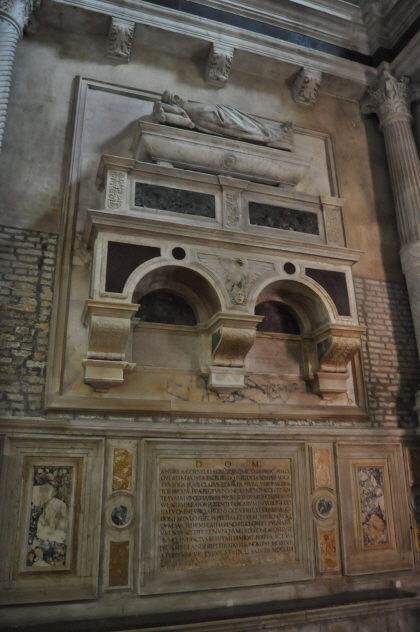
Identify the location of pillow. (169, 109), (174, 116).